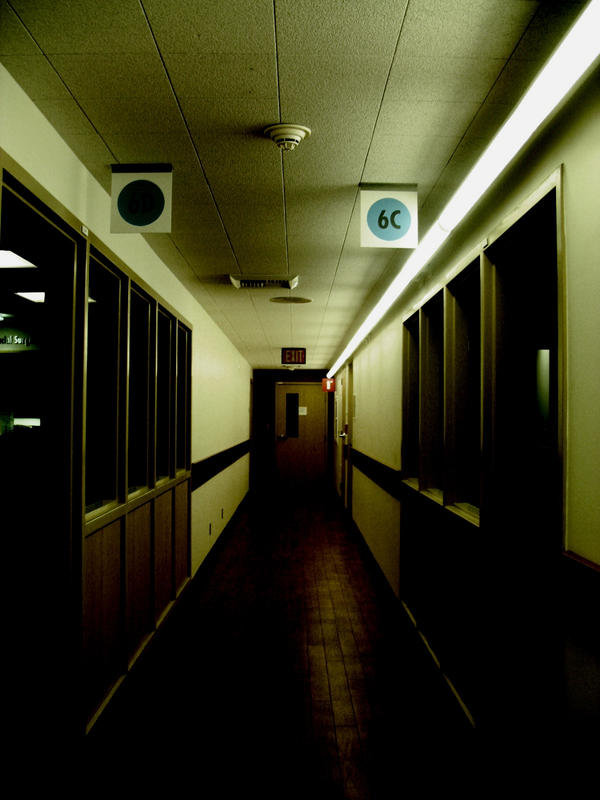
Where is `outlet`? This screenshot has height=800, width=600. outlet is located at coordinates (210, 526), (221, 512).